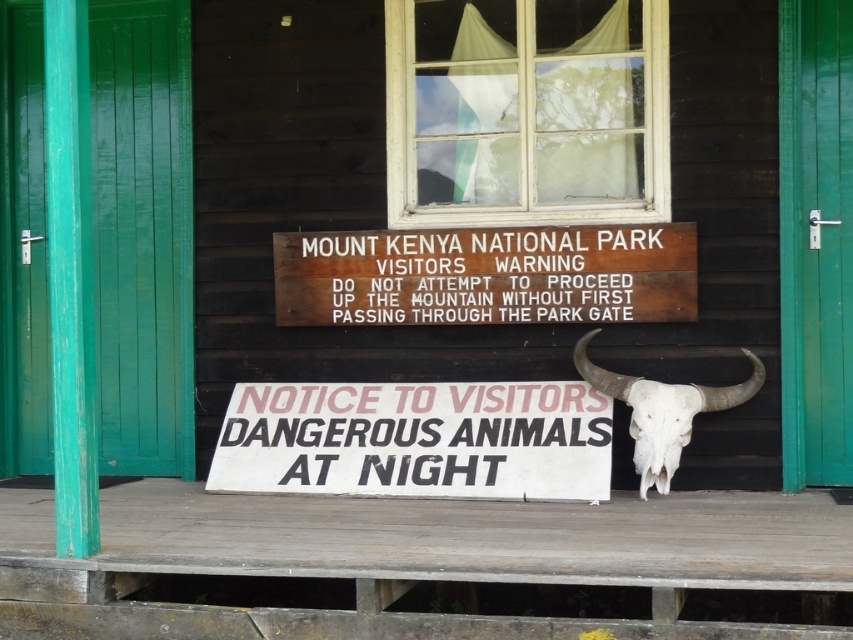
Who is taller, white bone skull at right or white bone skull at center?

With more height is white bone skull at right.

Is white bone skull at right thinner than white bone skull at center?

In fact, white bone skull at right might be wider than white bone skull at center.

Identify the location of white bone skull at right. This screenshot has height=640, width=853. (662, 412).

Is point (624, 301) in front of point (636, 454)?

No, it is not.

Is brown wooden sign at upper center wider than white bone skull at center?

Yes.

This screenshot has height=640, width=853. What do you see at coordinates (486, 275) in the screenshot?
I see `brown wooden sign at upper center` at bounding box center [486, 275].

I want to click on brown wooden sign at upper center, so click(x=486, y=275).

Which is more to the left, white paper sign at lower center or white bone skull at right?

From the viewer's perspective, white paper sign at lower center appears more on the left side.

Does white paper sign at lower center have a lesser height compared to white bone skull at right?

Correct, white paper sign at lower center is not as tall as white bone skull at right.

This screenshot has height=640, width=853. I want to click on white paper sign at lower center, so click(x=416, y=440).